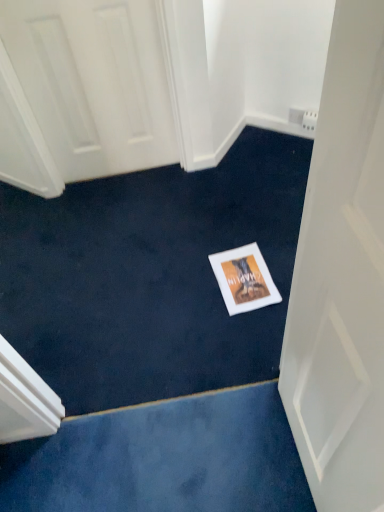
Identify the location of vacant point above white matte postcard at center (from a real-world perspective). The image size is (384, 512). (233, 270).